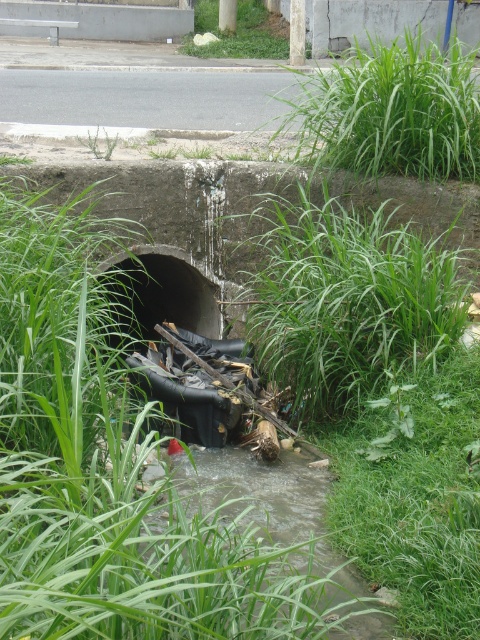
You are a gardener inspecting the drainage ditch. You notice two areas with green leafy grass at center and green leafy grass at upper right. Which area is located lower in the ditch?

The green leafy grass at center is located lower in the ditch because it is below the green leafy grass at upper right.

You are a gardener tasked with maintaining the area around the drainage ditch. You notice both the green leafy grass at center and the green leafy weed at center. Which of these two plants has a wider spread according to the description?

The green leafy grass at center might be wider than the green leafy weed at center according to the description.